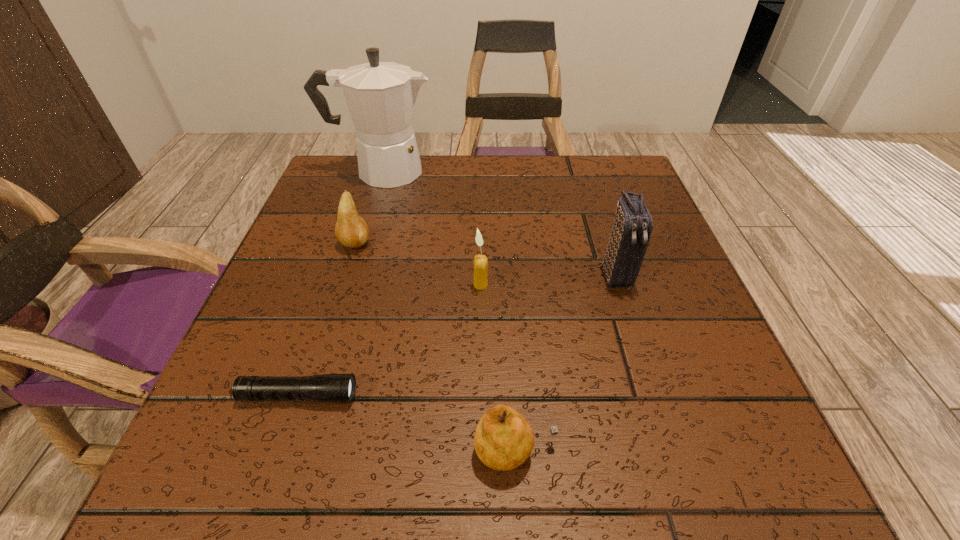
The image size is (960, 540). In order to click on pear situated at the left edge in this screenshot , I will do `click(351, 230)`.

This screenshot has height=540, width=960. In order to click on flashlight that is at the left edge in this screenshot , I will do `click(337, 388)`.

At what (x,y) coordinates should I click in order to perform the action: click on object that is at the right edge. Please return your answer as a coordinate pair (x, y). This screenshot has height=540, width=960. Looking at the image, I should click on (633, 224).

You are a GUI agent. You are given a task and a screenshot of the screen. Output one action in this format:
    pyautogui.click(x=<x>, y=<y>)
    Task: Click on the object that is positioned at the far left corner
    The image size is (960, 540).
    Given the screenshot: What is the action you would take?
    pyautogui.click(x=381, y=96)

At what (x,y) coordinates should I click in order to perform the action: click on vacant space at the far edge of the desktop. Please return your answer as a coordinate pair (x, y). This screenshot has height=540, width=960. Looking at the image, I should click on (437, 189).

In the image, there is a desktop. Where is `vacant space at the left edge`? vacant space at the left edge is located at coordinates (315, 238).

In the image, there is a desktop. What are the coordinates of `free space at the right edge` in the screenshot? It's located at (681, 264).

In the image, there is a desktop. Identify the location of vacant space at the near left corner. (286, 447).

The height and width of the screenshot is (540, 960). I want to click on free point at the far right corner, so [x=587, y=158].

At what (x,y) coordinates should I click in order to perform the action: click on vacant space at the near right corner of the desktop. Please return your answer as a coordinate pair (x, y). Looking at the image, I should click on (678, 457).